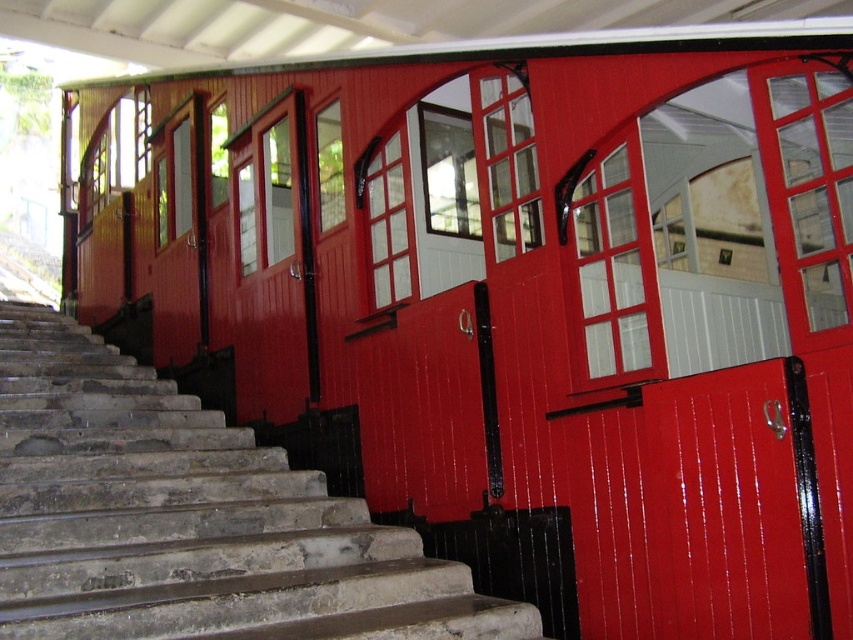
You are a delivery person carrying a large package that requires a 6 feet clearance to maneuver. You need to move from the stone stairs at lower left to the glossy wood door at center. Can you navigate through the space between them?

The distance between the stone stairs at lower left and the glossy wood door at center is 5.76 feet, which is less than the required 6 feet clearance. Therefore, you cannot navigate through the space between them with the large package.

You are a delivery person carrying a large package that is 1.2 meters wide. You need to move from the ground to the tram platform. The path requires you to go up the stone stairs at lower left and pass through the glossy wood door at center. Can your package fit through both the stairs and the door?

The stone stairs at lower left might be wider than glossy wood door at center. Since the package is 1.2 meters wide, it depends on the actual width of the door. If the door is at least 1.2 meters wide, the package can pass through. However, if the door is narrower, it might not fit. The stairs might accommodate the package if their width is sufficient, but without exact measurements, it is uncertain.

You are standing at the base of the stone steps in front of the red tram station. You see two points marked on the ground. The first point is at coordinates point [236,563] and the second point is at point [763,630]. If you want to walk towards the tram station, which point should you step on first?

You should step on point [763,630] first because point [236,563] is behind it, meaning point [763,630] is closer to your current position at the base of the steps.